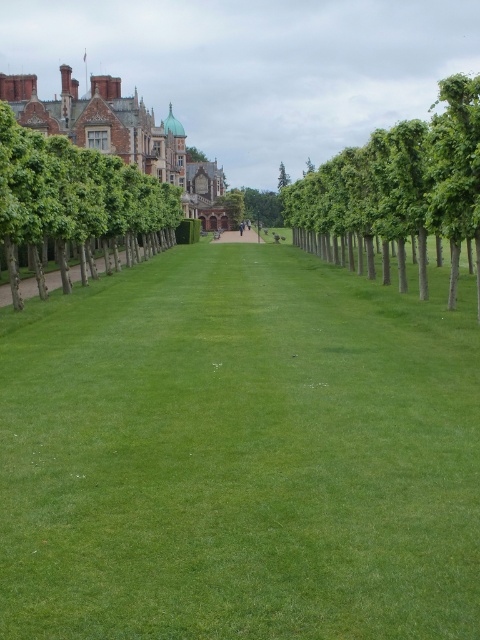
Question: Among these points, which one is farthest from the camera?

Choices:
 (A) pos(308,205)
 (B) pos(93,486)
 (C) pos(7,163)
 (D) pos(229,234)

Answer: (D)

Question: Among these objects, which one is farthest from the camera?

Choices:
 (A) green leafy trees at center
 (B) smooth stone path at center
 (C) green smooth lawn at center

Answer: (B)

Question: Does green leafy trees at center lie behind green leafy tree at left?

Choices:
 (A) no
 (B) yes

Answer: (A)

Question: Does green smooth lawn at center appear under green leafy trees at center?

Choices:
 (A) no
 (B) yes

Answer: (B)

Question: Which of the following is the closest to the observer?

Choices:
 (A) (14, 298)
 (B) (292, 612)

Answer: (B)

Question: Is green leafy trees at center below green leafy tree at left?

Choices:
 (A) yes
 (B) no

Answer: (B)